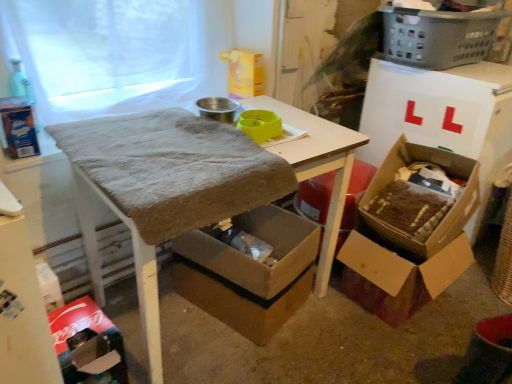
What do you see at coordinates (251, 258) in the screenshot? I see `cardboard box at lower center, acting as the first box starting from the left` at bounding box center [251, 258].

Image resolution: width=512 pixels, height=384 pixels. Describe the element at coordinates (317, 166) in the screenshot. I see `textured brown table at center` at that location.

Describe the element at coordinates (448, 212) in the screenshot. I see `cardboard box at right, which is the 1th box in right-to-left order` at that location.

Where is `cardboard box at lower center, the third box viewed from the right`? cardboard box at lower center, the third box viewed from the right is located at coordinates (251, 258).

From the image's perspective, does brown cardboard box at lower right, marked as the 2th box in a left-to-right arrangement, appear lower than white sheer fabric at upper left?

Indeed, from the image's perspective, brown cardboard box at lower right, marked as the 2th box in a left-to-right arrangement, is shown beneath white sheer fabric at upper left.

From a real-world perspective, relative to white sheer fabric at upper left, is brown cardboard box at lower right, marked as the 2th box in a left-to-right arrangement, vertically above or below?

Clearly, from a real-world perspective, brown cardboard box at lower right, marked as the 2th box in a left-to-right arrangement, is below white sheer fabric at upper left.

In terms of height, does brown cardboard box at lower right, marked as the 2th box in a left-to-right arrangement, look taller or shorter compared to white sheer fabric at upper left?

Considering their sizes, brown cardboard box at lower right, marked as the 2th box in a left-to-right arrangement, has less height than white sheer fabric at upper left.

Measure the distance between brown cardboard box at lower right, acting as the second box starting from the right, and white sheer fabric at upper left.

4.18 feet.

Find the location of `the 3rd box to the right when counting from the cardboard box at lower left`. the 3rd box to the right when counting from the cardboard box at lower left is located at coordinates (448, 212).

From the picture: From a real-world perspective, is cardboard box at lower left physically located above or below cardboard box at right, which is the 1th box in right-to-left order?

Clearly, from a real-world perspective, cardboard box at lower left is below cardboard box at right, which is the 1th box in right-to-left order.

Which object is positioned more to the right, cardboard box at lower left or cardboard box at right, which is the 1th box in right-to-left order?

cardboard box at right, which is the 1th box in right-to-left order, is more to the right.

Are cardboard box at lower left and cardboard box at right, which is the 1th box in right-to-left order, making contact?

No, cardboard box at lower left is not making contact with cardboard box at right, which is the 1th box in right-to-left order.

Considering the positions of objects cardboard box at lower left and textured brown table at center in the image provided, who is more to the left, cardboard box at lower left or textured brown table at center?

cardboard box at lower left.

Does cardboard box at lower left touch textured brown table at center?

There is a gap between cardboard box at lower left and textured brown table at center.

Which is behind, cardboard box at lower left or textured brown table at center?

cardboard box at lower left is behind.

From a real-world perspective, which is physically above, cardboard box at lower left or textured brown table at center?

From a 3D spatial view, textured brown table at center is above.

Is white sheer fabric at upper left inside or outside of textured brown table at center?

The correct answer is: outside.

Considering the points (127, 21) and (137, 293), which point is behind, point (127, 21) or point (137, 293)?

Point (137, 293)

From a real-world perspective, is white sheer fabric at upper left on textured brown table at center?

Correct, in the physical world, white sheer fabric at upper left is higher than textured brown table at center.

I want to click on table below the white sheer fabric at upper left (from the image's perspective), so click(317, 166).

Is cardboard box at lower center, the third box viewed from the right, touching cardboard box at lower left?

No, cardboard box at lower center, the third box viewed from the right, is not next to cardboard box at lower left.

Considering the sizes of objects cardboard box at lower center, acting as the first box starting from the left, and cardboard box at lower left in the image provided, who is shorter, cardboard box at lower center, acting as the first box starting from the left, or cardboard box at lower left?

Standing shorter between the two is cardboard box at lower left.

Considering the positions of objects cardboard box at lower center, acting as the first box starting from the left, and cardboard box at lower left in the image provided, who is more to the left, cardboard box at lower center, acting as the first box starting from the left, or cardboard box at lower left?

Positioned to the left is cardboard box at lower left.

Looking at this image, considering the sizes of objects cardboard box at lower center, acting as the first box starting from the left, and cardboard box at lower left in the image provided, who is bigger, cardboard box at lower center, acting as the first box starting from the left, or cardboard box at lower left?

cardboard box at lower center, acting as the first box starting from the left, is bigger.

Is there a large distance between textured brown table at center and white sheer fabric at upper left?

They are positioned close to each other.

Is point (150, 369) behind point (170, 81)?

No, (150, 369) is in front of (170, 81).

From a real-world perspective, is textured brown table at center on white sheer fabric at upper left?

No, from a real-world perspective, textured brown table at center is not on top of white sheer fabric at upper left.

What's the angular difference between textured brown table at center and white sheer fabric at upper left's facing directions?

They differ by 1.6 degrees in their facing directions.

Is cardboard box at lower center, acting as the first box starting from the left, far away from cardboard box at right, which is the 1th box in right-to-left order?

No, there isn't a large distance between cardboard box at lower center, acting as the first box starting from the left, and cardboard box at right, which is the 1th box in right-to-left order.

Is cardboard box at lower center, the third box viewed from the right, at the right side of cardboard box at right, the 3th box from the left?

Incorrect, cardboard box at lower center, the third box viewed from the right, is not on the right side of cardboard box at right, the 3th box from the left.

Is cardboard box at lower center, acting as the first box starting from the left, bigger than cardboard box at right, the 3th box from the left?

Yes, cardboard box at lower center, acting as the first box starting from the left, is bigger than cardboard box at right, the 3th box from the left.

Which is less distant, (x=226, y=271) or (x=392, y=165)?

The point (x=226, y=271) is closer to the camera.

This screenshot has height=384, width=512. I want to click on window screen on the left side of brown cardboard box at lower right, marked as the 2th box in a left-to-right arrangement, so click(106, 54).

You are a GUI agent. You are given a task and a screenshot of the screen. Output one action in this format:
    pyautogui.click(x=<x>, y=<y>)
    Task: Click on the cardboard box below the cardboard box at right, the 3th box from the left (from the image's perspective)
    This screenshot has height=384, width=512.
    Given the screenshot: What is the action you would take?
    pyautogui.click(x=88, y=344)

Based on their spatial positions, is textured brown table at center or cardboard box at right, which is the 1th box in right-to-left order, further from cardboard box at lower left?

cardboard box at right, which is the 1th box in right-to-left order.

Considering their positions, is cardboard box at right, which is the 1th box in right-to-left order, positioned closer to white sheer fabric at upper left than textured brown table at center?

Based on the image, textured brown table at center appears to be nearer to white sheer fabric at upper left.

Based on their spatial positions, is cardboard box at right, which is the 1th box in right-to-left order, or gray plastic laundry basket at upper right further from brown cardboard box at lower right, acting as the second box starting from the right?

gray plastic laundry basket at upper right is further to brown cardboard box at lower right, acting as the second box starting from the right.

Which object lies nearer to the anchor point cardboard box at lower center, acting as the first box starting from the left, white sheer fabric at upper left or brown cardboard box at lower right, marked as the 2th box in a left-to-right arrangement?

brown cardboard box at lower right, marked as the 2th box in a left-to-right arrangement.

Which object lies nearer to the anchor point cardboard box at right, the 3th box from the left, gray plastic laundry basket at upper right or brown cardboard box at lower right, marked as the 2th box in a left-to-right arrangement?

brown cardboard box at lower right, marked as the 2th box in a left-to-right arrangement.

Consider the image. Estimate the real-world distances between objects in this image. Which object is closer to cardboard box at lower center, the third box viewed from the right, white sheer fabric at upper left or cardboard box at lower left?

cardboard box at lower left lies closer to cardboard box at lower center, the third box viewed from the right, than the other object.

Estimate the real-world distances between objects in this image. Which object is further from cardboard box at lower center, acting as the first box starting from the left, cardboard box at right, which is the 1th box in right-to-left order, or textured brown table at center?

cardboard box at right, which is the 1th box in right-to-left order, is positioned further to the anchor cardboard box at lower center, acting as the first box starting from the left.

From the image, which object appears to be nearer to brown cardboard box at lower right, acting as the second box starting from the right, white sheer fabric at upper left or cardboard box at lower left?

cardboard box at lower left is positioned closer to the anchor brown cardboard box at lower right, acting as the second box starting from the right.

Where is `table between gray plastic laundry basket at upper right and cardboard box at lower center, acting as the first box starting from the left, in the vertical direction`? table between gray plastic laundry basket at upper right and cardboard box at lower center, acting as the first box starting from the left, in the vertical direction is located at coordinates (317, 166).

Locate an element on the screen. The height and width of the screenshot is (384, 512). box situated between textured brown table at center and brown cardboard box at lower right, acting as the second box starting from the right, from left to right is located at coordinates (251, 258).

Locate an element on the screen. The width and height of the screenshot is (512, 384). table that lies between white sheer fabric at upper left and cardboard box at lower center, the third box viewed from the right, from top to bottom is located at coordinates (317, 166).

The image size is (512, 384). Find the location of `table situated between cardboard box at lower left and brown cardboard box at lower right, acting as the second box starting from the right, from left to right`. table situated between cardboard box at lower left and brown cardboard box at lower right, acting as the second box starting from the right, from left to right is located at coordinates (317, 166).